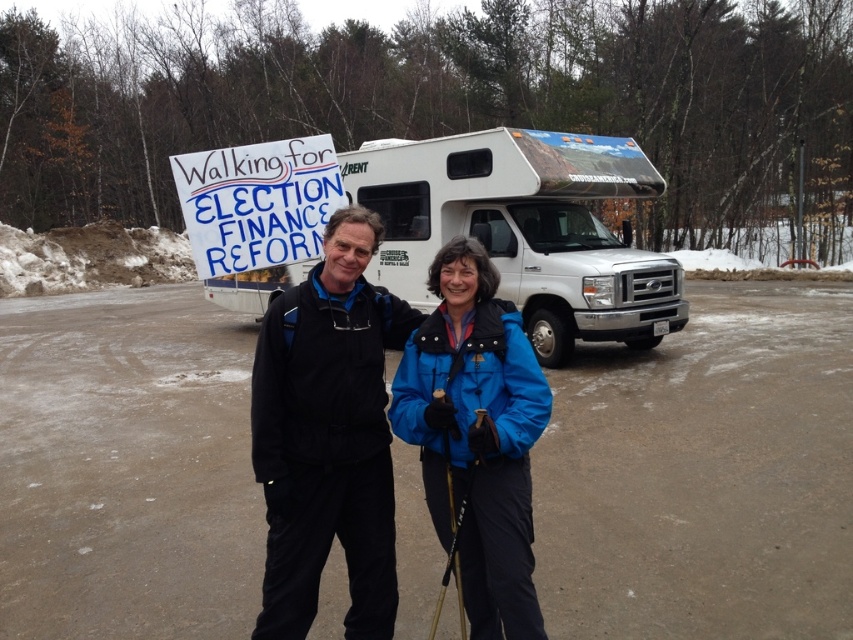
Question: Which point appears closest to the camera in this image?

Choices:
 (A) (608, 300)
 (B) (450, 513)

Answer: (B)

Question: Is white vinyl recreational vehicle at upper center to the right of matte black jacket at center from the viewer's perspective?

Choices:
 (A) no
 (B) yes

Answer: (A)

Question: Which is farther from the blue synthetic jacket at center?

Choices:
 (A) matte black jacket at center
 (B) black plastic ski pole at center

Answer: (A)

Question: Does white vinyl recreational vehicle at upper center have a greater width compared to blue synthetic jacket at center?

Choices:
 (A) yes
 (B) no

Answer: (B)

Question: Is white vinyl recreational vehicle at upper center to the right of matte black jacket at center from the viewer's perspective?

Choices:
 (A) yes
 (B) no

Answer: (B)

Question: Among these objects, which one is nearest to the camera?

Choices:
 (A) black plastic ski pole at center
 (B) blue synthetic jacket at center
 (C) white vinyl recreational vehicle at upper center

Answer: (B)